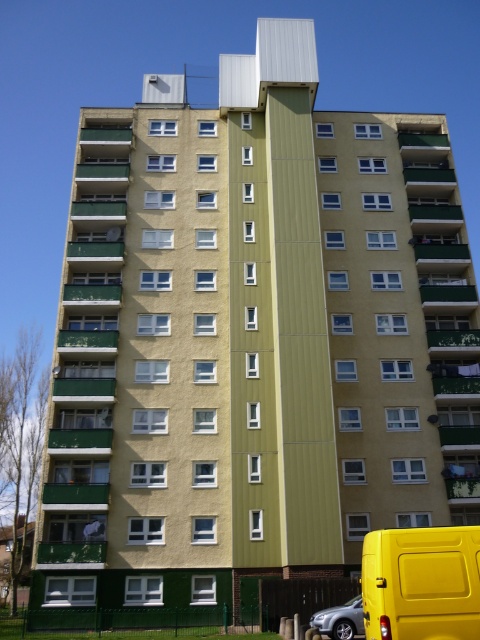
Question: Does yellow matte van at lower right appear on the left side of silver metallic car at lower center?

Choices:
 (A) yes
 (B) no

Answer: (B)

Question: Among these points, which one is farthest from the camera?

Choices:
 (A) (361, 632)
 (B) (457, 624)

Answer: (A)

Question: Among these objects, which one is nearest to the camera?

Choices:
 (A) silver metallic car at lower center
 (B) yellow matte van at lower right

Answer: (B)

Question: Is yellow matte van at lower right below silver metallic car at lower center?

Choices:
 (A) yes
 (B) no

Answer: (B)

Question: Does yellow matte van at lower right have a lesser width compared to silver metallic car at lower center?

Choices:
 (A) no
 (B) yes

Answer: (A)